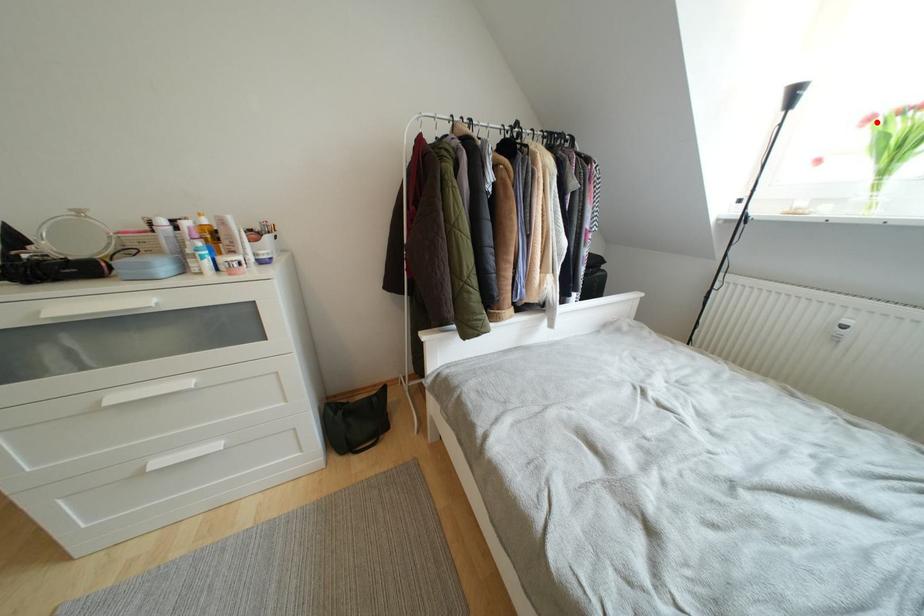
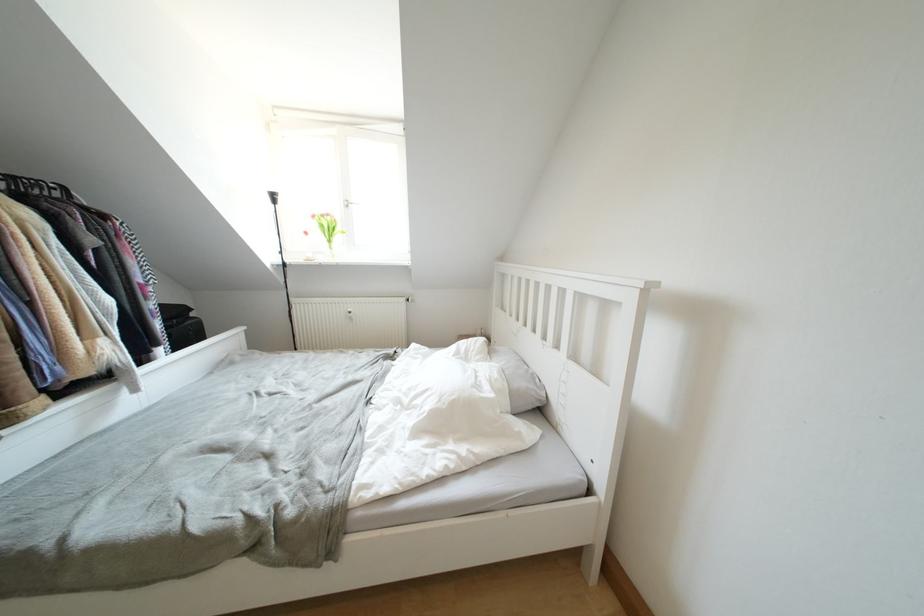
The point at the highlighted location is marked in the first image. Where is the corresponding point in the second image?

(319, 220)